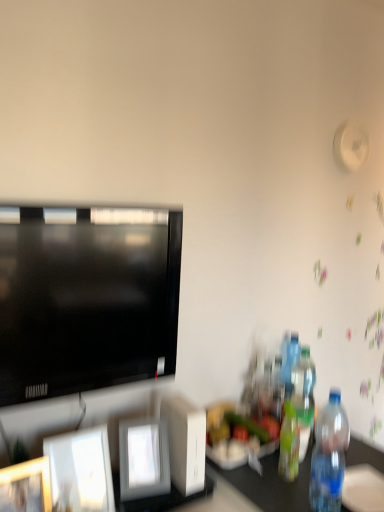
Question: From the image's perspective, relative to matte black television at left, is white glossy picture frame at center, marked as the 1th picture frame in a right-to-left arrangement, above or below?

Choices:
 (A) below
 (B) above

Answer: (A)

Question: From a real-world perspective, is white glossy picture frame at center, marked as the 1th picture frame in a right-to-left arrangement, positioned above or below matte black television at left?

Choices:
 (A) below
 (B) above

Answer: (A)

Question: Estimate the real-world distances between objects in this image. Which object is farther from the translucent plastic bottle at right, which is the second bottle from front to back?

Choices:
 (A) translucent plastic bottle at right, the 2th bottle when ordered from back to front
 (B) white glossy picture frame at center, marked as the 1th picture frame in a right-to-left arrangement
 (C) matte black television at left
 (D) translucent plastic bottle at right, the 4th bottle viewed from the front
 (E) transparent plastic bottle at right, the fourth bottle in the back-to-front sequence

Answer: (C)

Question: Which object is the closest to the translucent plastic bottle at right, the third bottle positioned from the front?

Choices:
 (A) translucent plastic bottle at right, marked as the 1th bottle in a back-to-front arrangement
 (B) transparent plastic bottle at right, the fourth bottle in the back-to-front sequence
 (C) white glossy picture frame at center, marked as the 1th picture frame in a right-to-left arrangement
 (D) matte black television at left
 (E) white glossy picture frame at lower left, the second picture frame from the left

Answer: (A)